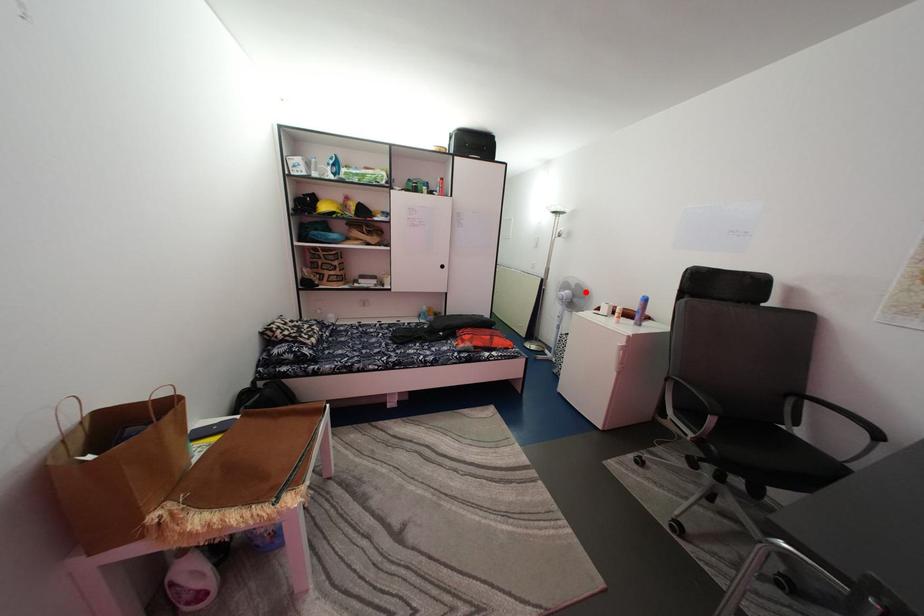
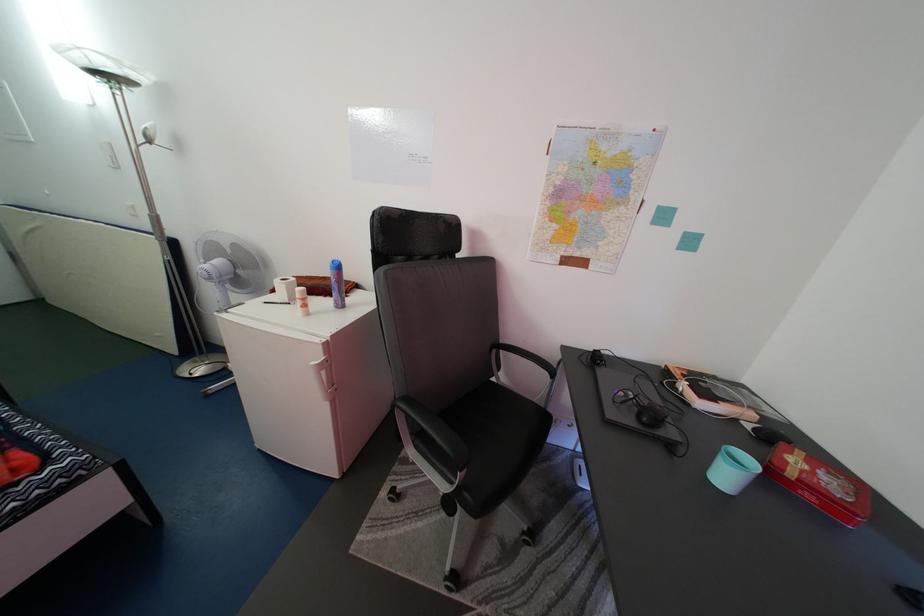
Question: I am providing you with two images of the same scene from different viewpoints. A red point is shown in image1. For the corresponding object point in image2, is it positioned nearer or farther from the camera?

Choices:
 (A) Nearer
 (B) Farther

Answer: (B)